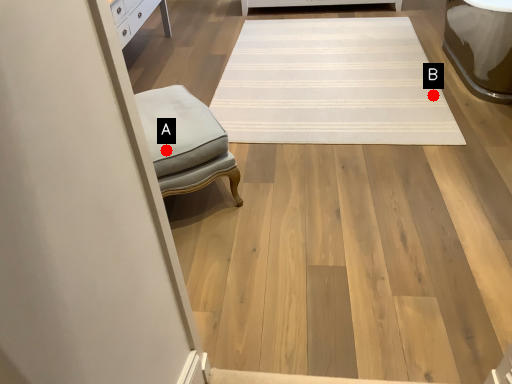
Question: Two points are circled on the image, labeled by A and B beside each circle. Among these points, which one is nearest to the camera?

Choices:
 (A) A is closer
 (B) B is closer

Answer: (A)